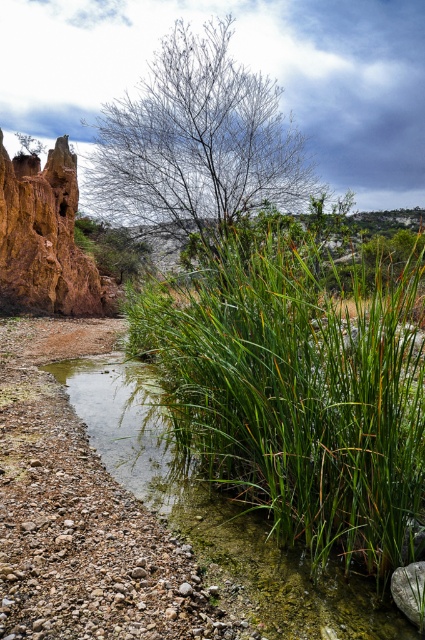
Is point (192, 141) positioned before point (82, 292)?

Yes, point (192, 141) is in front of point (82, 292).

Which is in front, point (241, 68) or point (65, 300)?

Positioned in front is point (241, 68).

Does point (232, 118) come farther from viewer compared to point (62, 186)?

No, (232, 118) is in front of (62, 186).

At what (x,y) coordinates should I click in order to perform the action: click on bare branches at upper center. Please return your answer as a coordinate pair (x, y). The image size is (425, 640). Looking at the image, I should click on (197, 141).

Which of these two, green leafy grass at center or rustic clay cliff at left, stands taller?

rustic clay cliff at left

Image resolution: width=425 pixels, height=640 pixels. What do you see at coordinates (299, 387) in the screenshot?
I see `green leafy grass at center` at bounding box center [299, 387].

Locate an element on the screen. Image resolution: width=425 pixels, height=640 pixels. green leafy grass at center is located at coordinates pos(299,387).

Does green leafy grass at center appear under bare branches at upper center?

Yes, green leafy grass at center is below bare branches at upper center.

In the scene shown: Which is above, green leafy grass at center or bare branches at upper center?

bare branches at upper center

Measure the distance between green leafy grass at center and camera.

green leafy grass at center is 10.20 feet from camera.

Locate an element on the screen. green leafy grass at center is located at coordinates (299, 387).